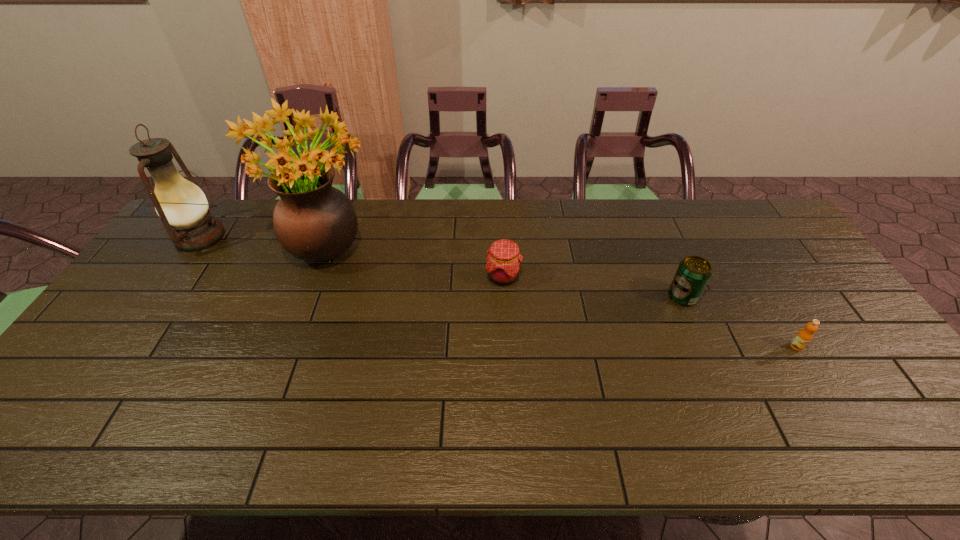
What are the coordinates of `the closest object to the leftmost object` in the screenshot? It's located at click(313, 221).

Where is `the second closest object to the leftmost object`? the second closest object to the leftmost object is located at coordinates (504, 260).

Where is `vacant space that satisfies the following two spatial constraints: 1. on the front side of the third object from right to left; 2. on the left side of the leftmost object`? The image size is (960, 540). vacant space that satisfies the following two spatial constraints: 1. on the front side of the third object from right to left; 2. on the left side of the leftmost object is located at coordinates (173, 277).